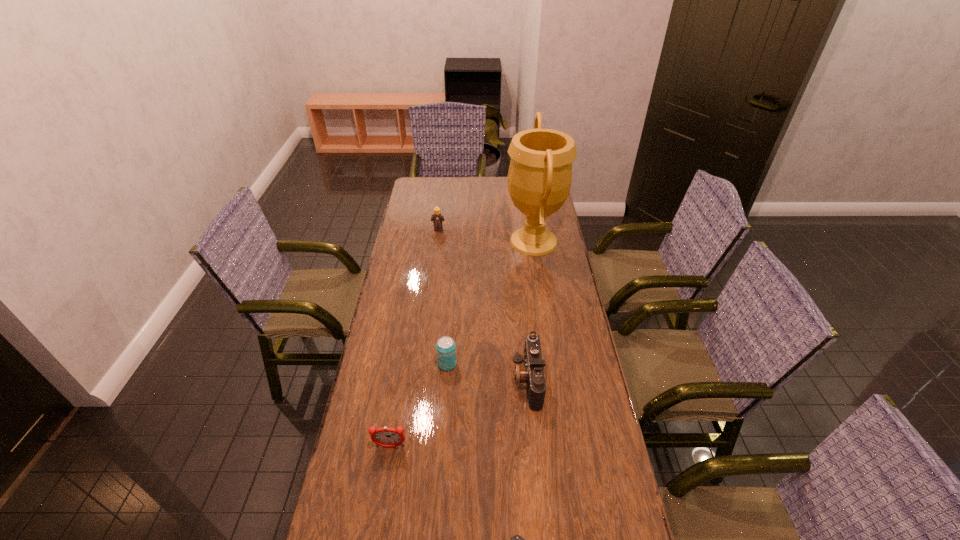
Find the location of a particular element. The image size is (960, 540). the tallest object is located at coordinates (540, 173).

Identify the location of Lego. click(x=437, y=218).

You are a GUI agent. You are given a task and a screenshot of the screen. Output one action in this format:
    pyautogui.click(x=<x>, y=<y>)
    Task: Click on the camera
    The width and height of the screenshot is (960, 540).
    Given the screenshot: What is the action you would take?
    pyautogui.click(x=532, y=373)

You are a GUI agent. You are given a task and a screenshot of the screen. Output one action in this format:
    pyautogui.click(x=<x>, y=<y>)
    Task: Click on the third object from left to right
    The width and height of the screenshot is (960, 540).
    Given the screenshot: What is the action you would take?
    pyautogui.click(x=445, y=347)

The width and height of the screenshot is (960, 540). What are the coordinates of `alarm clock` in the screenshot? It's located at (387, 437).

Identify the location of blank area located 0.260m on the engravings side of the trophy. The width and height of the screenshot is (960, 540). (445, 241).

What are the coordinates of `vacant space located on the engravings side of the trophy` in the screenshot? It's located at (488, 241).

Image resolution: width=960 pixels, height=540 pixels. What are the coordinates of `vacant space located 0.170m on the engravings side of the trophy` in the screenshot? It's located at (466, 241).

Locate an element on the screen. free location located in front of the Lego is located at coordinates (436, 251).

At what (x,y) coordinates should I click in order to perform the action: click on free spot located on the front-facing side of the camera. Please return your answer as a coordinate pair (x, y). This screenshot has width=960, height=540. Looking at the image, I should click on (400, 380).